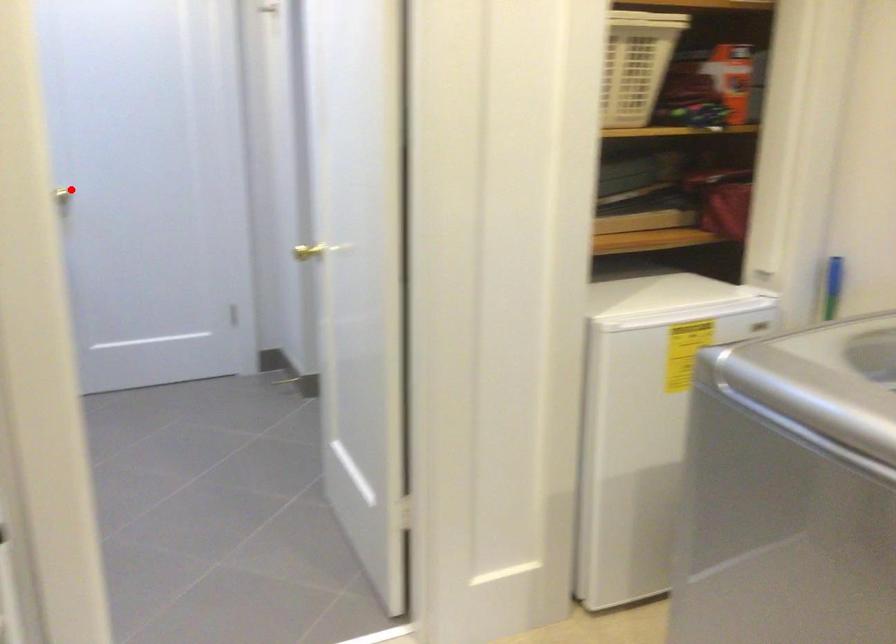
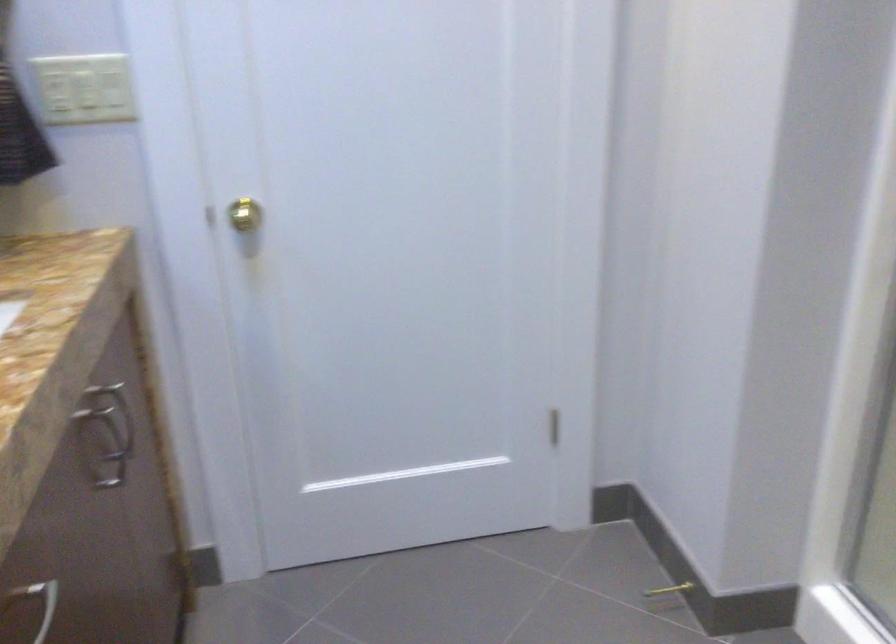
Question: I am providing you with two images of the same scene from different viewpoints. In image1, a red point is highlighted. Considering the same 3D point in image2, which of the following is correct?

Choices:
 (A) It is closer
 (B) It is farther

Answer: (A)